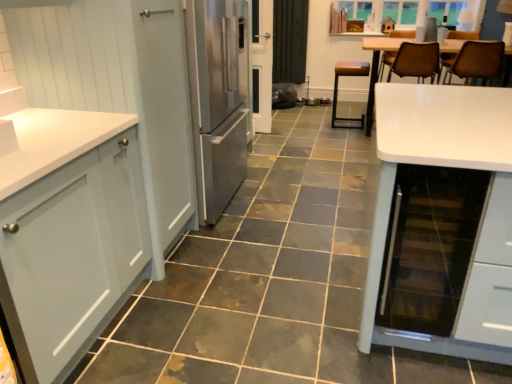
What are the coordinates of `vacant space to the left of black glass wine cooler at right` in the screenshot? It's located at (342, 344).